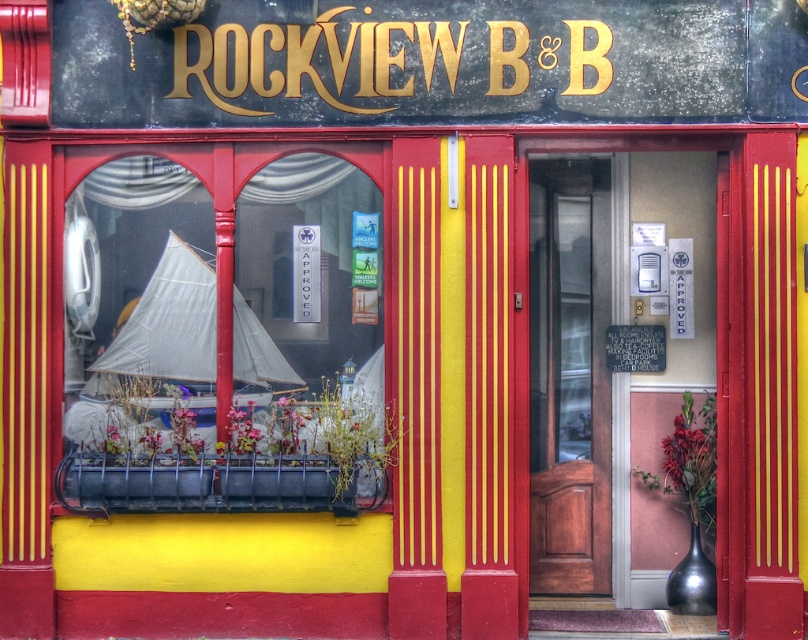
Is wooden door at center taller than gold metallic sign at upper center?

Yes, wooden door at center is taller than gold metallic sign at upper center.

Does point (566, 237) come closer to viewer compared to point (369, 68)?

No, (566, 237) is behind (369, 68).

In order to click on wooden door at center in this screenshot , I will do `click(611, 365)`.

Does mahogany wood door at center have a larger size compared to gold metallic sign at upper center?

Yes.

Can you confirm if mahogany wood door at center is positioned above gold metallic sign at upper center?

No, mahogany wood door at center is not above gold metallic sign at upper center.

Measure the distance between mahogany wood door at center and camera.

mahogany wood door at center and camera are 26.84 feet apart from each other.

Find the location of `mahogany wood door at center`. mahogany wood door at center is located at coordinates (571, 368).

Based on the photo, between wooden door at center and mahogany wood door at center, which one is positioned higher?

mahogany wood door at center

Looking at this image, is wooden door at center above mahogany wood door at center?

Incorrect, wooden door at center is not positioned above mahogany wood door at center.

Who is more distant from viewer, (705, 307) or (567, 259)?

The point (567, 259) is behind.

You are a GUI agent. You are given a task and a screenshot of the screen. Output one action in this format:
    pyautogui.click(x=<x>, y=<y>)
    Task: Click on the wooden door at center
    This screenshot has width=808, height=640.
    Given the screenshot: What is the action you would take?
    pyautogui.click(x=611, y=365)